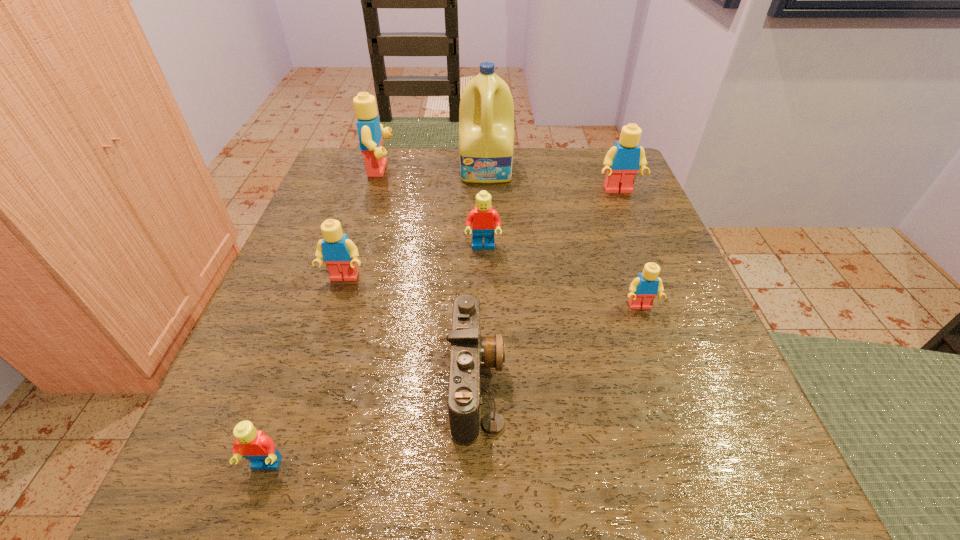
Find the location of a particular element. the fifth farthest Lego is located at coordinates (643, 289).

Identify the location of the smallest yellow Lego. (643, 289).

This screenshot has width=960, height=540. Find the location of `the smaller red Lego`. the smaller red Lego is located at coordinates (255, 446).

The height and width of the screenshot is (540, 960). Find the location of `the nearer red Lego`. the nearer red Lego is located at coordinates (255, 446).

Identify the location of vacant area situated 0.240m on the label of the detergent. Image resolution: width=960 pixels, height=540 pixels. (489, 254).

You are a GUI agent. You are given a task and a screenshot of the screen. Output one action in this format:
    pyautogui.click(x=<x>, y=<y>)
    Task: Click on the free space located 0.320m on the front-facing side of the farthest yellow Lego
    
    Given the screenshot: What is the action you would take?
    pyautogui.click(x=529, y=170)

This screenshot has height=540, width=960. I want to click on free point located 0.380m on the front-facing side of the fifth shortest Lego, so click(x=677, y=335).

Find the location of a particular element. free space located on the front-facing side of the second nearest yellow Lego is located at coordinates tap(268, 518).

Find the location of `free space located on the face of the third Lego from right to left`. free space located on the face of the third Lego from right to left is located at coordinates (484, 360).

Find the location of `vacant space situated 0.320m on the front-facing side of the second nearest object`. vacant space situated 0.320m on the front-facing side of the second nearest object is located at coordinates (728, 381).